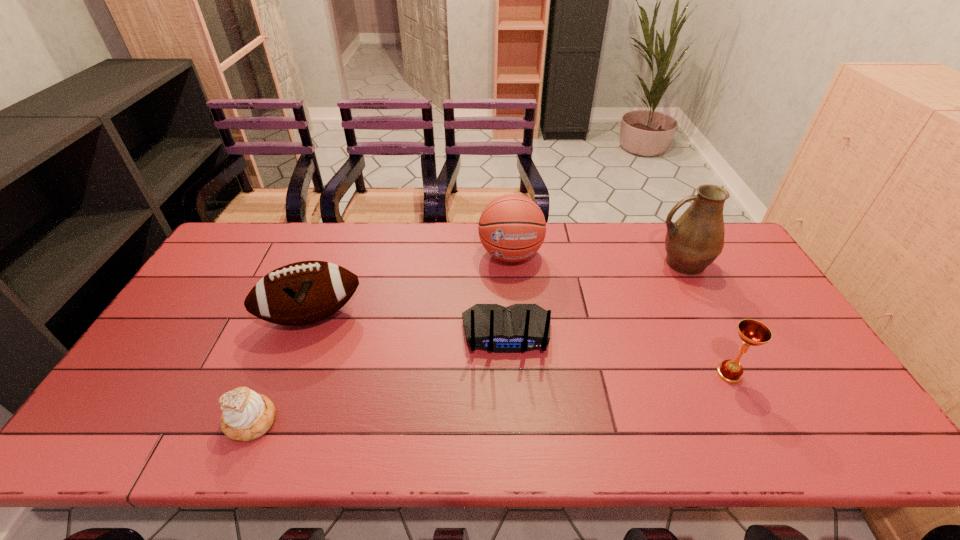
In the image, there is a desktop. Where is `vacant area at the far edge`? vacant area at the far edge is located at coordinates (314, 239).

Identify the location of vacant space at the near edge of the desktop. (737, 417).

Find the location of a particular element. The image size is (960, 540). vacant space at the left edge is located at coordinates (210, 323).

This screenshot has height=540, width=960. In the image, there is a desktop. Identify the location of free space at the right edge. (715, 267).

Find the location of a particular element. This screenshot has width=960, height=540. free region at the far left corner of the desktop is located at coordinates (223, 248).

Find the location of a particular element. free space between the router and the chalice is located at coordinates (617, 353).

This screenshot has width=960, height=540. What are the coordinates of `free space between the router and the nearest object` in the screenshot? It's located at (379, 377).

At what (x,y) coordinates should I click in order to perform the action: click on vacant point located between the chalice and the router. Please return your answer as a coordinate pair (x, y). The width and height of the screenshot is (960, 540). Looking at the image, I should click on (617, 353).

The height and width of the screenshot is (540, 960). I want to click on empty location between the chalice and the basketball, so click(x=620, y=314).

This screenshot has height=540, width=960. I want to click on free space between the pastry and the chalice, so click(490, 397).